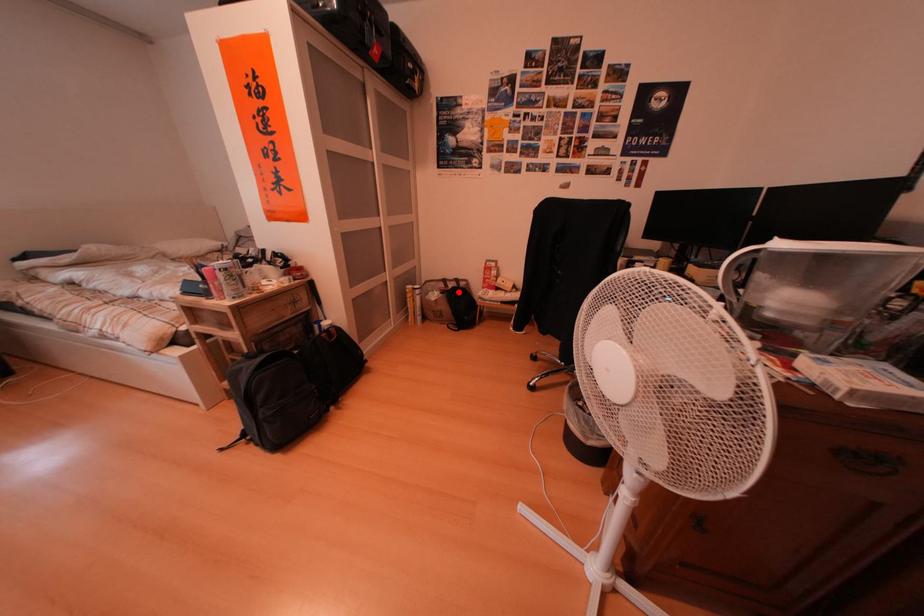
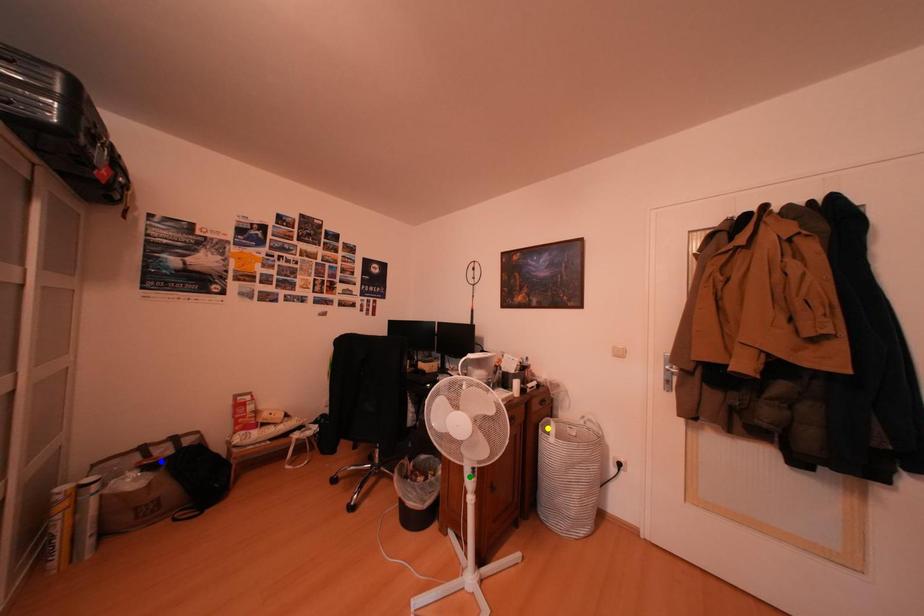
Question: I am providing you with two images of the same scene from different viewpoints. A red point is marked on the first image. You are given multiple points on the second image. Which point in image 2 represents the same 3d spot as the red point in image 1?

Choices:
 (A) yellow point
 (B) green point
 (C) blue point

Answer: (C)